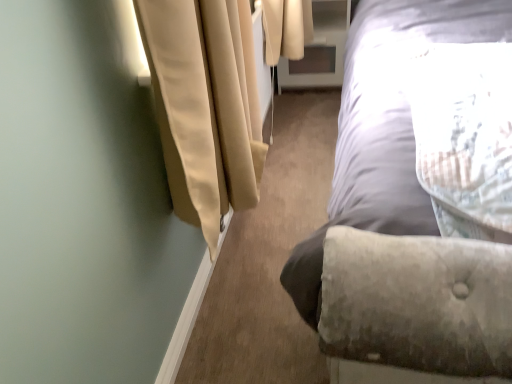
Question: In terms of width, does clear glass screen door at upper center look wider or thinner when compared to velvet gray bed at right?

Choices:
 (A) wide
 (B) thin

Answer: (B)

Question: In terms of size, does clear glass screen door at upper center appear bigger or smaller than velvet gray bed at right?

Choices:
 (A) small
 (B) big

Answer: (A)

Question: Is clear glass screen door at upper center inside the boundaries of velvet gray bed at right, or outside?

Choices:
 (A) outside
 (B) inside

Answer: (A)

Question: Do you think velvet gray bed at right is within clear glass screen door at upper center, or outside of it?

Choices:
 (A) inside
 (B) outside

Answer: (B)

Question: Considering the positions of point (487, 372) and point (311, 49), is point (487, 372) closer or farther from the camera than point (311, 49)?

Choices:
 (A) farther
 (B) closer

Answer: (B)

Question: Would you say velvet gray bed at right is to the left or to the right of clear glass screen door at upper center in the picture?

Choices:
 (A) right
 (B) left

Answer: (A)

Question: From the image's perspective, is velvet gray bed at right located above or below clear glass screen door at upper center?

Choices:
 (A) below
 (B) above

Answer: (A)